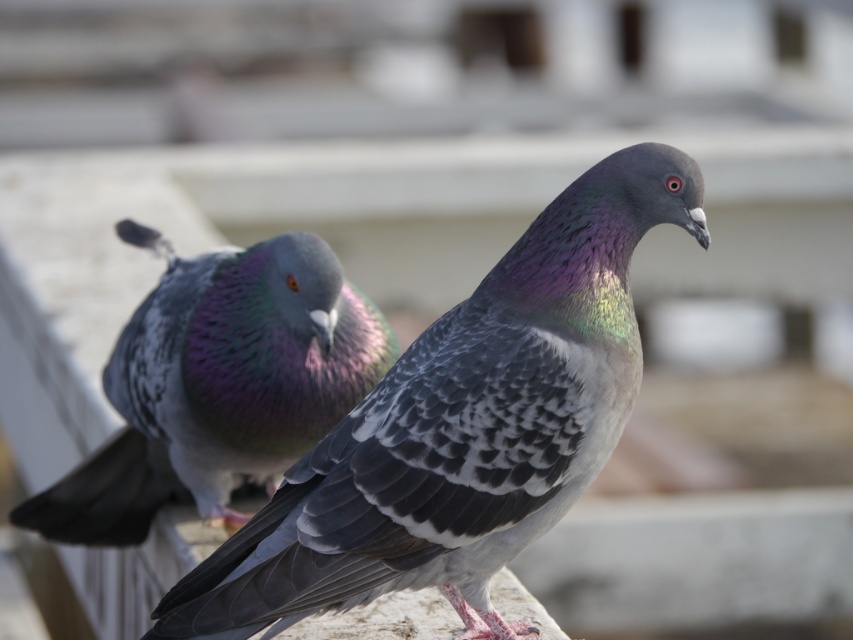
You are a birdwatcher trying to capture both pigeons in your camera frame. The pigeon labeled as shiny iridescent pigeon at center and the shiny iridescent feathers at center are both in your view. Since your camera can only focus on one object at a time, which object should you choose to ensure the pigeon itself is fully in focus?

You should focus on the shiny iridescent pigeon at center because it has a lesser width compared to the shiny iridescent feathers at center, making it easier to capture the entire pigeon within the camera frame.

You are a birdwatcher observing two shiny iridescent pigeons in the scene. Which object, the shiny iridescent pigeon at center or the shiny iridescent feathers at center, is located to the right?

The shiny iridescent pigeon at center is positioned on the right side of the shiny iridescent feathers at center, so the pigeon is to the right of the feathers.

You are a photographer trying to capture the shiny iridescent pigeon at center. You notice a point marked at coordinates (461,428). Based on the scene description, is this point likely located on the shiny iridescent pigeon at center?

Yes, the point (461,428) corresponds to the shiny iridescent pigeon at center according to the objects description.